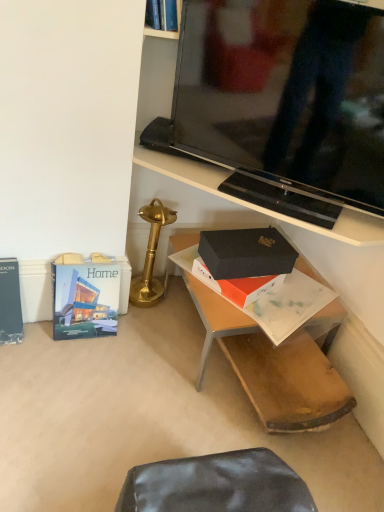
Locate an element on the screen. Image resolution: width=384 pixels, height=512 pixels. free location to the left of black matte box at center is located at coordinates pyautogui.click(x=105, y=358).